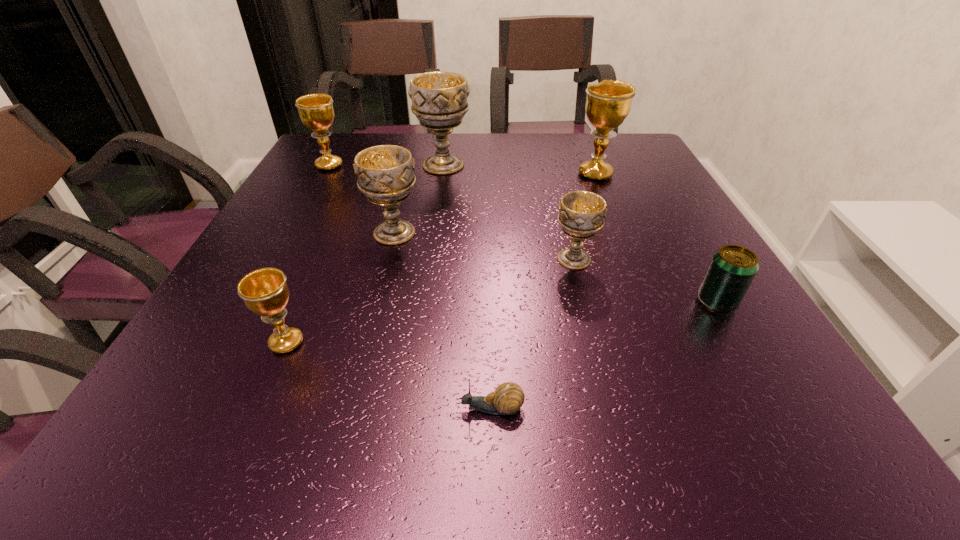
What are the coordinates of `vacant space at the near edge` in the screenshot? It's located at click(440, 406).

Locate an element on the screen. vacant region at the left edge is located at coordinates (291, 286).

Locate an element on the screen. vacant space at the right edge of the desktop is located at coordinates (708, 262).

Locate an element on the screen. The width and height of the screenshot is (960, 540). vacant space at the far left corner of the desktop is located at coordinates (345, 139).

You are a GUI agent. You are given a task and a screenshot of the screen. Output one action in this format:
    pyautogui.click(x=<x>, y=<y>)
    Task: Click on the free spot at the far right corner of the desktop
    
    Given the screenshot: What is the action you would take?
    pyautogui.click(x=625, y=154)

In order to click on vacant space at the near right corner in this screenshot , I will do `click(722, 421)`.

Identify the location of free spot between the biggest gold chalice and the third nearest object. The width and height of the screenshot is (960, 540). (657, 238).

This screenshot has width=960, height=540. Identify the location of free space between the second biggest white chalice and the leftmost chalice. (362, 199).

Identify the location of vacant space in between the escargot and the rightmost object. The height and width of the screenshot is (540, 960). (604, 355).

The image size is (960, 540). What are the coordinates of `vacant space that's between the rightmost object and the leftmost gold chalice` in the screenshot? It's located at (523, 234).